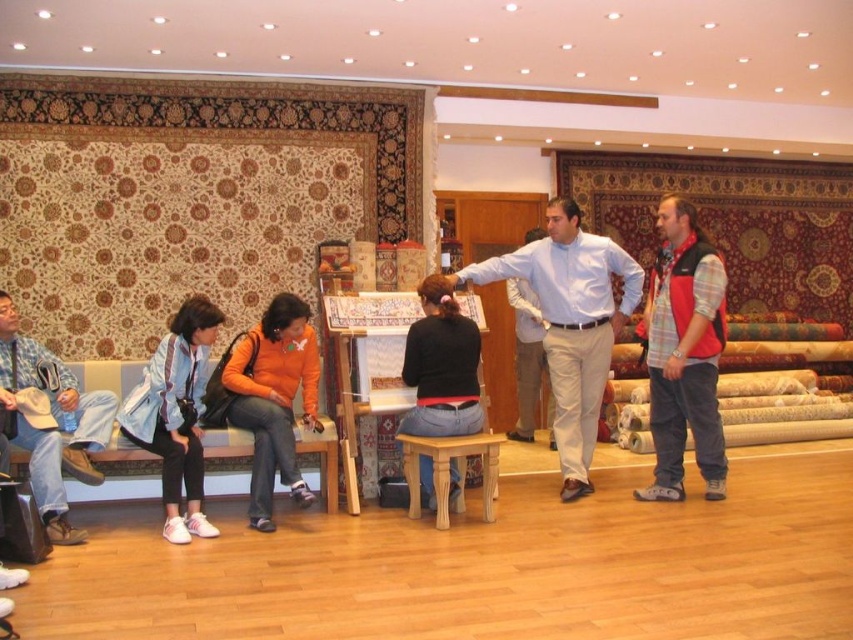
Question: Estimate the real-world distances between objects in this image. Which object is farther from the black matte shirt at center?

Choices:
 (A) light brown wooden stool at center
 (B) orange fabric jacket at center
 (C) light blue shirt at center

Answer: (B)

Question: Does red plaid shirt at right come behind orange fabric jacket at center?

Choices:
 (A) no
 (B) yes

Answer: (B)

Question: Which object is positioned closest to the black matte shirt at center?

Choices:
 (A) light blue shirt at center
 (B) white shirt at center

Answer: (A)

Question: Which of the following is the farthest from the observer?

Choices:
 (A) red plaid shirt at right
 (B) light brown wooden stool at center
 (C) black matte shirt at center
 (D) denim jeans at left

Answer: (A)

Question: In this image, where is orange fabric jacket at center located relative to light brown wooden stool at center?

Choices:
 (A) left
 (B) right

Answer: (A)

Question: Is red plaid shirt at right behind white shirt at center?

Choices:
 (A) no
 (B) yes

Answer: (A)